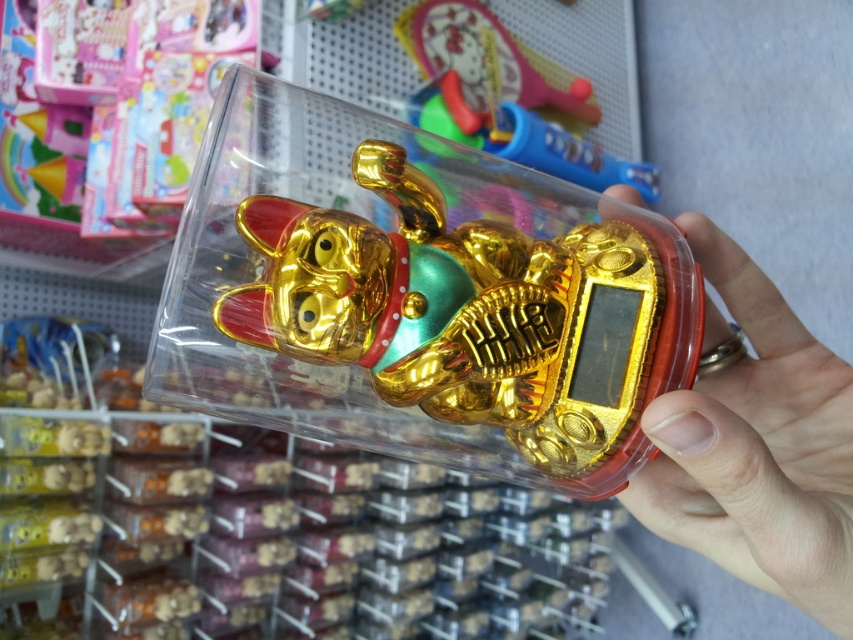
In the scene shown: Who is more forward, (485, 276) or (682, 445)?

Point (682, 445) is in front.

Is gold shiny lucky cat at center closer to camera compared to gold metallic hand at center?

That is False.

Is point (585, 310) farther from viewer compared to point (828, 624)?

Yes, it is.

The height and width of the screenshot is (640, 853). I want to click on gold shiny lucky cat at center, so click(480, 316).